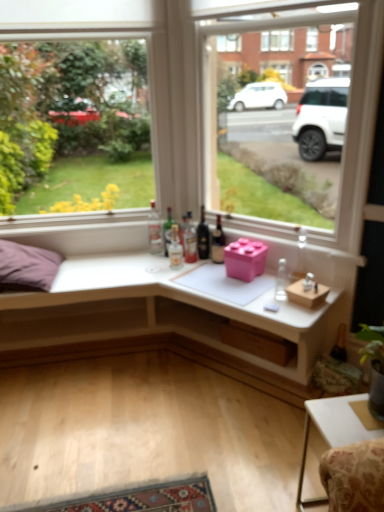
I want to click on free space that is to the left of translucent glass bottle at center, the 4th bottle viewed from the right, so click(153, 265).